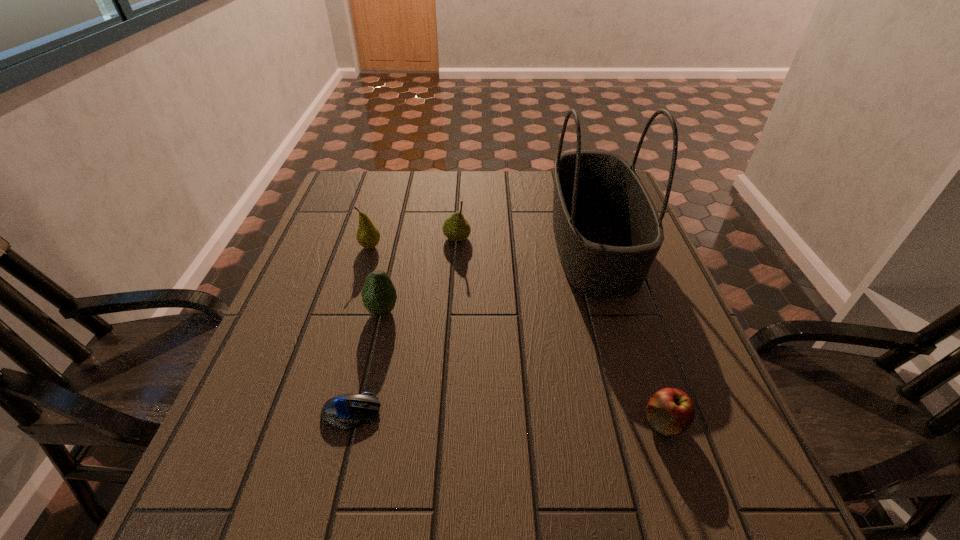
Find the location of a particular element. This screenshot has width=960, height=540. vacant region located 0.070m on the front of the apple is located at coordinates (685, 483).

You are a GUI agent. You are given a task and a screenshot of the screen. Output one action in this format:
    pyautogui.click(x=<x>, y=<y>)
    Task: Click on the free location located on the button side of the shortest object
    
    Given the screenshot: What is the action you would take?
    pyautogui.click(x=478, y=412)

Find the location of a particular element. The height and width of the screenshot is (540, 960). object that is at the far edge is located at coordinates (608, 232).

You are a GUI agent. You are given a task and a screenshot of the screen. Output one action in this format:
    pyautogui.click(x=<x>, y=<y>)
    Task: Click on the object at the left edge
    This screenshot has width=960, height=540.
    Given the screenshot: What is the action you would take?
    pyautogui.click(x=368, y=236)

Image resolution: width=960 pixels, height=540 pixels. Find the location of `basket that is at the right edge`. basket that is at the right edge is located at coordinates (608, 232).

Where is `apple present at the right edge`? apple present at the right edge is located at coordinates tap(670, 411).

Identify the location of object that is at the far right corner. (608, 232).

Where is `vacant space at the far edge of the desktop`? vacant space at the far edge of the desktop is located at coordinates (x=436, y=179).

What are the coordinates of `vacant space at the near edge of the desktop` in the screenshot? It's located at (635, 476).

The image size is (960, 540). What are the coordinates of `free space at the left edge of the desktop` in the screenshot? It's located at (336, 222).